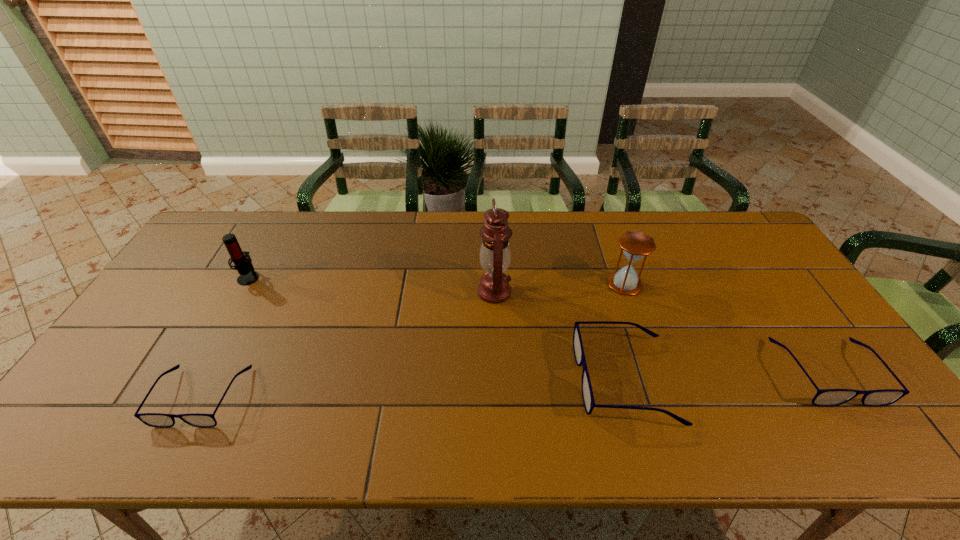
This screenshot has width=960, height=540. Identify the location of vacant space situated 0.270m on the front-facing side of the second spectacles from right to left. (469, 380).

At what (x,y) coordinates should I click in order to perform the action: click on vacant space located on the front-facing side of the second spectacles from right to left. Please return your answer as a coordinate pair (x, y). Looking at the image, I should click on (534, 380).

The image size is (960, 540). Find the location of `vacant space located on the front of the microphone`. vacant space located on the front of the microphone is located at coordinates (197, 370).

Locate an element on the screen. The image size is (960, 540). vacant space situated on the left of the hourglass is located at coordinates (485, 284).

What are the coordinates of `free point located 0.210m on the front of the fourth object from right to left` in the screenshot? It's located at (496, 370).

You are a GUI agent. You are given a task and a screenshot of the screen. Output one action in this format:
    pyautogui.click(x=<x>, y=<y>)
    Task: Click on the object at the right edge
    
    Given the screenshot: What is the action you would take?
    pyautogui.click(x=825, y=397)

At what (x,y) coordinates should I click in order to perform the action: click on object that is positioned at the near right corner. Please return your answer as a coordinate pair (x, y). This screenshot has width=960, height=540. Looking at the image, I should click on coord(825,397).

Identify the location of free point at the far edge. (479, 218).

This screenshot has width=960, height=540. I want to click on vacant space at the near edge, so click(760, 406).

Locate an element on the screen. vacant region at the left edge of the desktop is located at coordinates (154, 318).